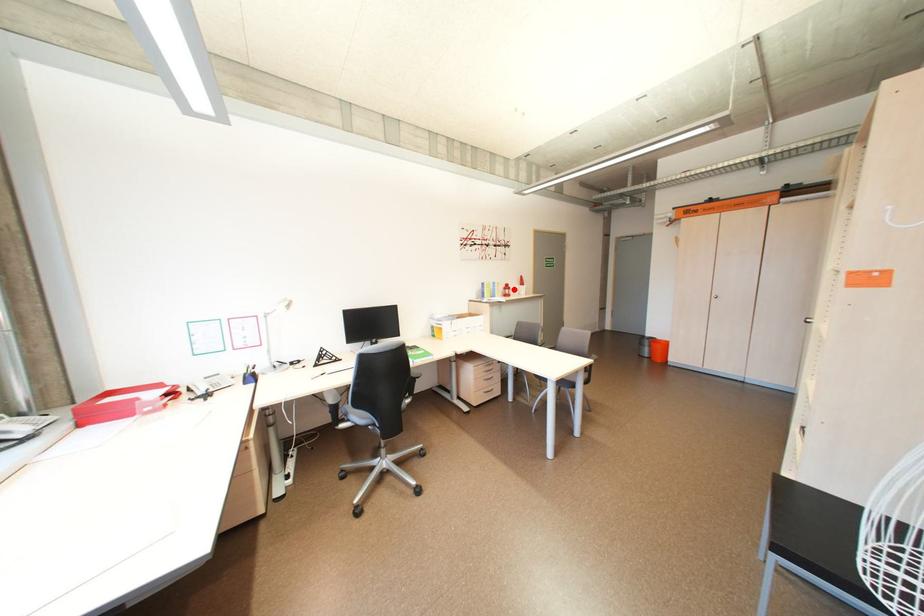
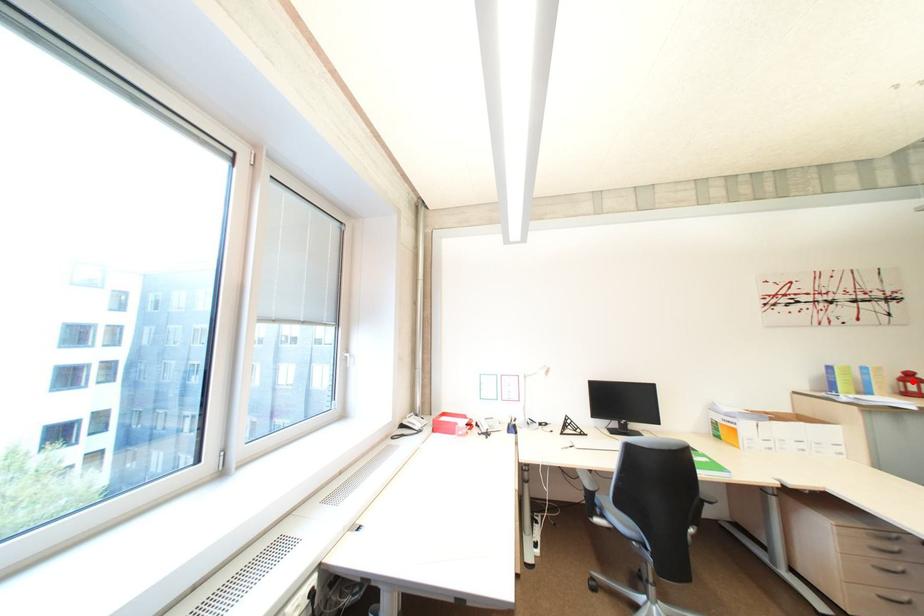
I am providing you with two images of the same scene from different viewpoints. A red point is marked on the first image and another point is marked on the second image. Does the point marked in image1 correspond to the same location as the one in image2?

Yes